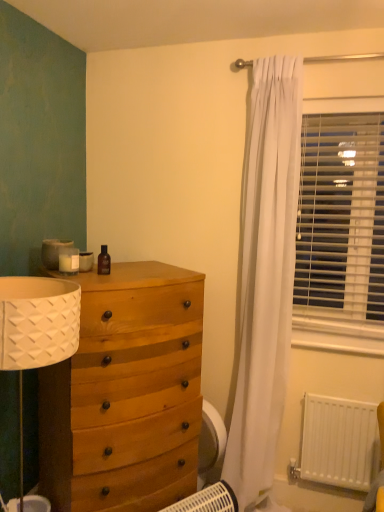
Question: Based on their sizes in the image, would you say white plastic heater at lower center is bigger or smaller than white matte radiator at lower right?

Choices:
 (A) big
 (B) small

Answer: (B)

Question: Looking at their shapes, would you say white plastic heater at lower center is wider or thinner than white matte radiator at lower right?

Choices:
 (A) wide
 (B) thin

Answer: (A)

Question: Estimate the real-world distances between objects in this image. Which object is farther from the white plastic blinds at right?

Choices:
 (A) white matte radiator at lower right
 (B) wooden chest of drawers at left
 (C) white plastic heater at lower center
 (D) brown glass bottle at upper center

Answer: (C)

Question: Estimate the real-world distances between objects in this image. Which object is farther from the white plastic blinds at right?

Choices:
 (A) brown glass bottle at upper center
 (B) wooden chest of drawers at left
 (C) white matte radiator at lower right
 (D) white plastic heater at lower center

Answer: (D)